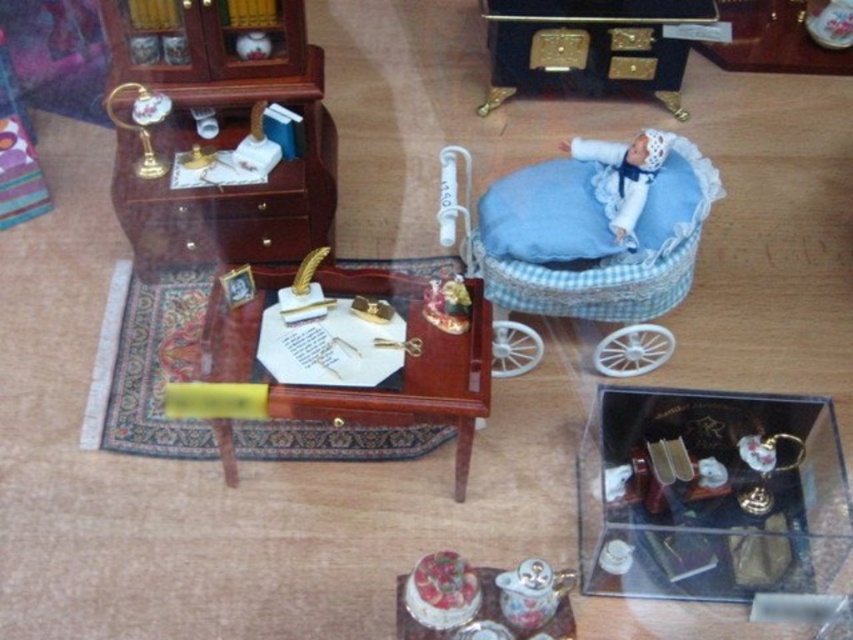
You are organizing a dollhouse and need to place the white fabric doll at upper right into the clear plastic box at center. Based on their sizes, will the doll fit inside the box?

The clear plastic box at center might be wider than white fabric doll at upper right, so there is a possibility that the doll could fit inside the box. However, since the exact dimensions aren not provided, it is recommended to check the box and doll sizes carefully before placing the doll inside.

You are a guest at a party and see both the clear plastic box at center and the smooth porcelain cake at center on the table. You want to place a small decorative item between them. Which object should you move to the side to create space?

You should move the clear plastic box at center to the side because it is wider than the smooth porcelain cake at center, allowing more space to place the decorative item.